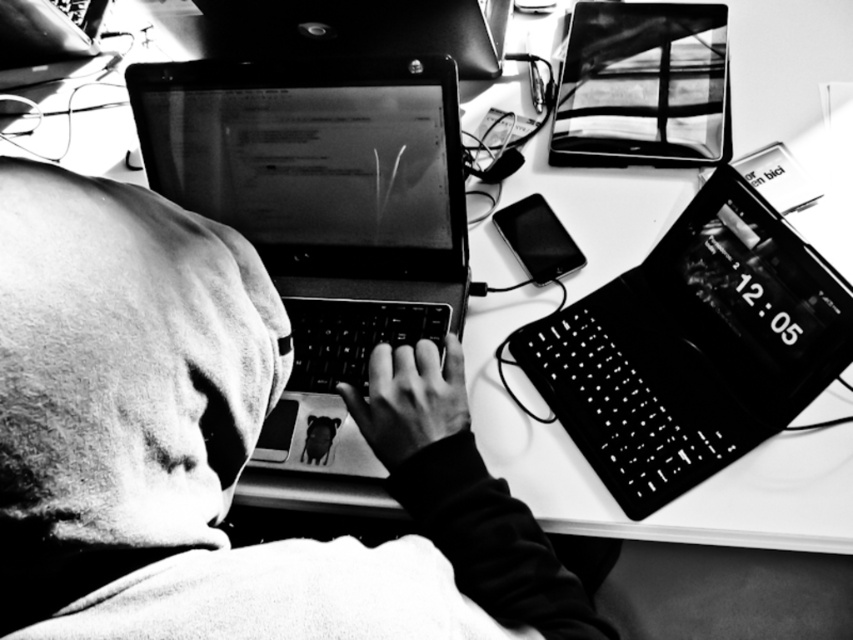
Can you confirm if matte black laptop at center is bigger than glossy plastic laptop at upper center?

Incorrect, matte black laptop at center is not larger than glossy plastic laptop at upper center.

Is matte black laptop at center to the left of glossy plastic laptop at upper center from the viewer's perspective?

Indeed, matte black laptop at center is positioned on the left side of glossy plastic laptop at upper center.

Image resolution: width=853 pixels, height=640 pixels. Describe the element at coordinates (322, 212) in the screenshot. I see `matte black laptop at center` at that location.

Image resolution: width=853 pixels, height=640 pixels. Find the location of `matte black laptop at center`. matte black laptop at center is located at coordinates (322, 212).

Can you confirm if matte black laptop at center is thinner than matte black laptop at right?

In fact, matte black laptop at center might be wider than matte black laptop at right.

Is matte black laptop at center taller than matte black laptop at right?

Yes.

This screenshot has width=853, height=640. Describe the element at coordinates (322, 212) in the screenshot. I see `matte black laptop at center` at that location.

Image resolution: width=853 pixels, height=640 pixels. I want to click on matte black laptop at center, so click(322, 212).

From the picture: Between smooth fabric hoodie at center and matte black laptop at center, which one has more height?

With more height is matte black laptop at center.

What are the coordinates of `smooth fabric hoodie at center` in the screenshot? It's located at (219, 449).